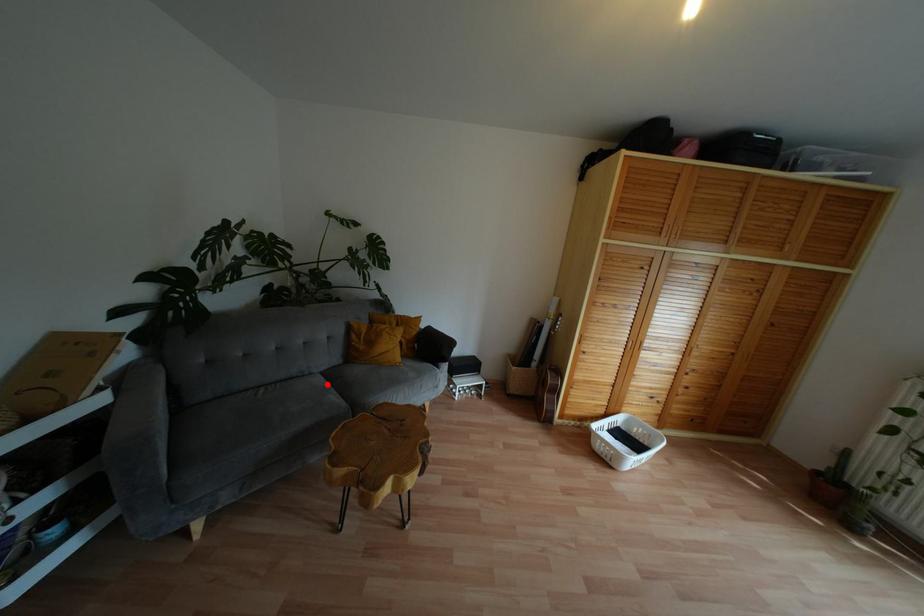
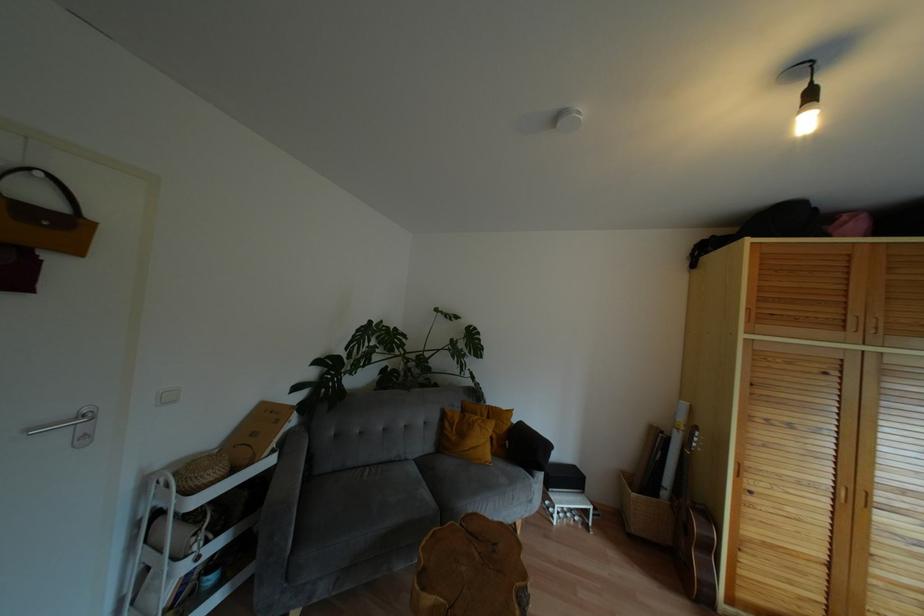
Find the pixel in the second image that matches the highlighted location in the first image.

(419, 476)